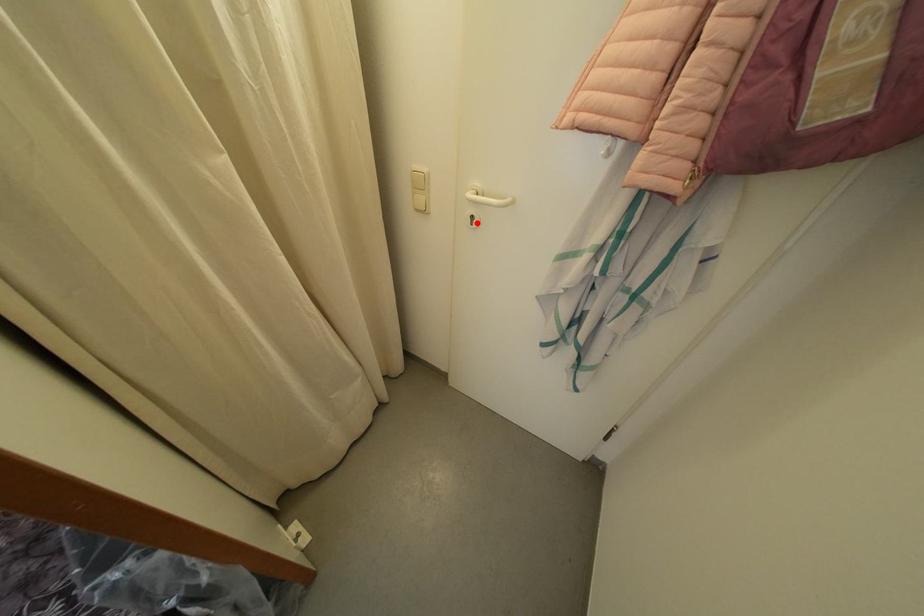
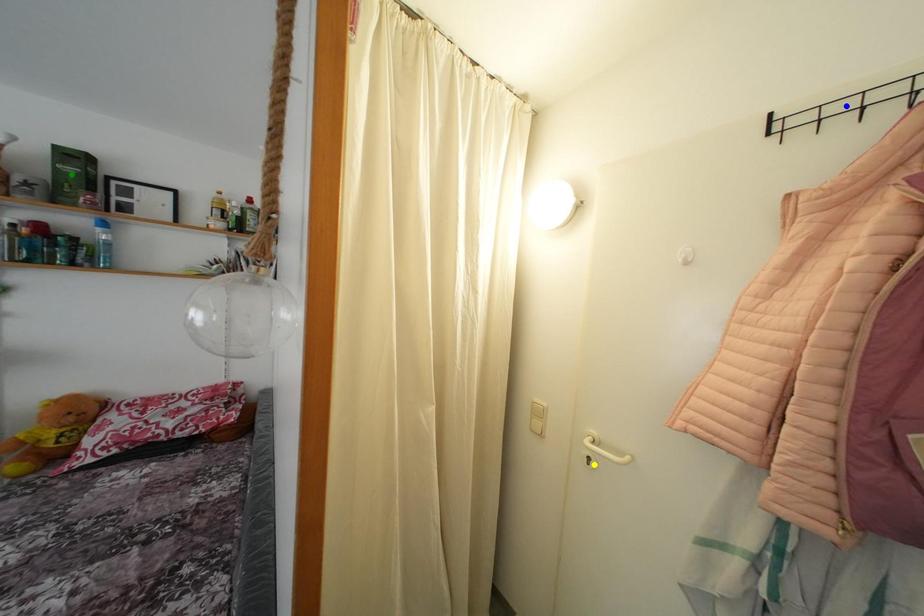
Question: I am providing you with two images of the same scene from different viewpoints. A red point is marked on the first image. You are given multiple points on the second image. Which spot in image 2 lines up with the point in image 1?

Choices:
 (A) yellow point
 (B) blue point
 (C) green point

Answer: (A)